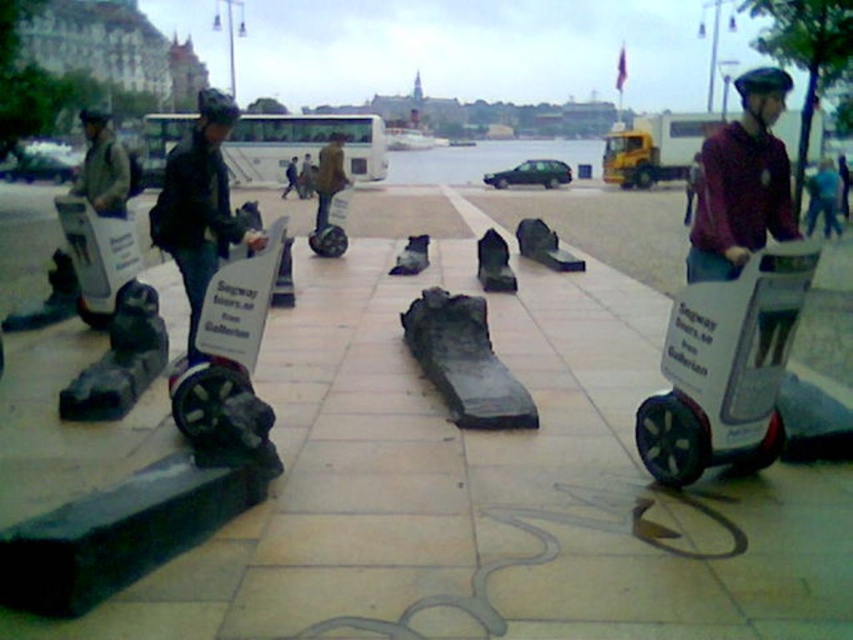
Between smooth concrete slabs at center and matte black helmet at left, which one appears on the right side from the viewer's perspective?

smooth concrete slabs at center

Measure the distance between smooth concrete slabs at center and camera.

A distance of 1.98 meters exists between smooth concrete slabs at center and camera.

Locate an element on the screen. The height and width of the screenshot is (640, 853). smooth concrete slabs at center is located at coordinates (483, 481).

Is purple matte helmet at upper right bigger than blue fabric helmet at upper right?

Correct, purple matte helmet at upper right is larger in size than blue fabric helmet at upper right.

Between point (712, 216) and point (840, 225), which one is positioned behind?

Point (840, 225)

Where is `purple matte helmet at upper right`? The width and height of the screenshot is (853, 640). purple matte helmet at upper right is located at coordinates (741, 182).

Can you confirm if smooth concrete slabs at center is positioned above dark blue helmet at center?

No, smooth concrete slabs at center is not above dark blue helmet at center.

The height and width of the screenshot is (640, 853). I want to click on smooth concrete slabs at center, so click(x=483, y=481).

This screenshot has height=640, width=853. I want to click on smooth concrete slabs at center, so click(x=483, y=481).